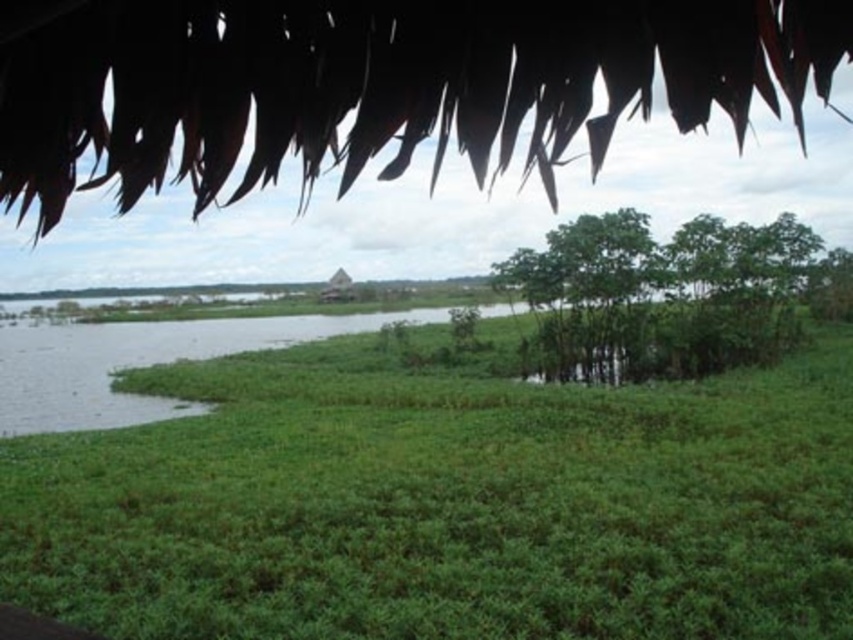
Measure the distance from green leafy grass at center to green leafy tree at upper center.

They are 13.53 meters apart.

Can you confirm if green leafy grass at center is positioned below green leafy tree at upper center?

Yes, green leafy grass at center is below green leafy tree at upper center.

Locate an element on the screen. green leafy grass at center is located at coordinates (444, 504).

Does green leafy grass at center have a greater width compared to green leafy trees at center-right?

Yes, green leafy grass at center is wider than green leafy trees at center-right.

Is point (10, 483) in front of point (532, 298)?

That is True.

Which is behind, point (256, 522) or point (665, 282)?

Point (665, 282)

Identify the location of green leafy grass at center. This screenshot has height=640, width=853. (444, 504).

Is green leafy tree at upper center closer to camera compared to green leafy trees at center-right?

Yes, it is.

Can you confirm if green leafy tree at upper center is bigger than green leafy trees at center-right?

Correct, green leafy tree at upper center is larger in size than green leafy trees at center-right.

Where is `green leafy tree at upper center`? This screenshot has height=640, width=853. green leafy tree at upper center is located at coordinates [x=374, y=83].